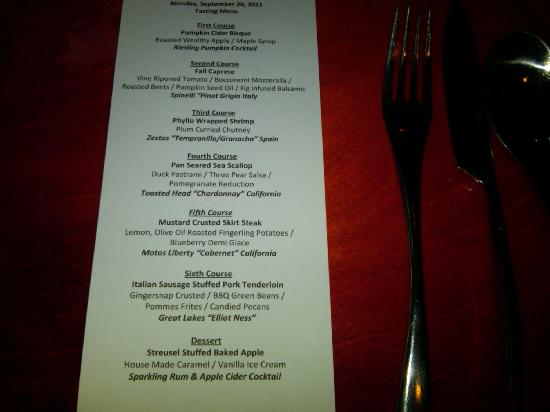
At what (x,y) coordinates should I click in order to perform the action: click on butter knife blade. Please return your answer as a coordinate pair (x, y). Looking at the image, I should click on (468, 104).